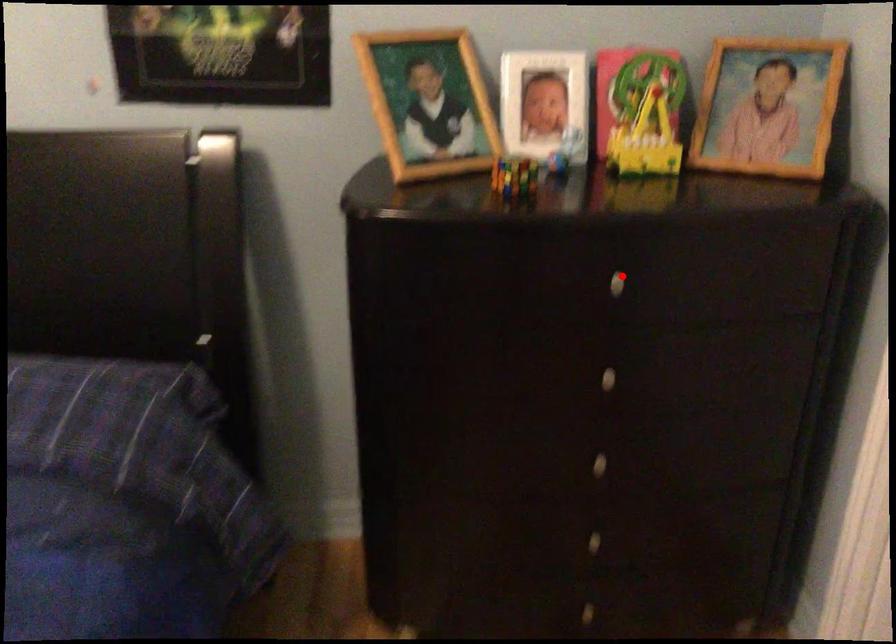
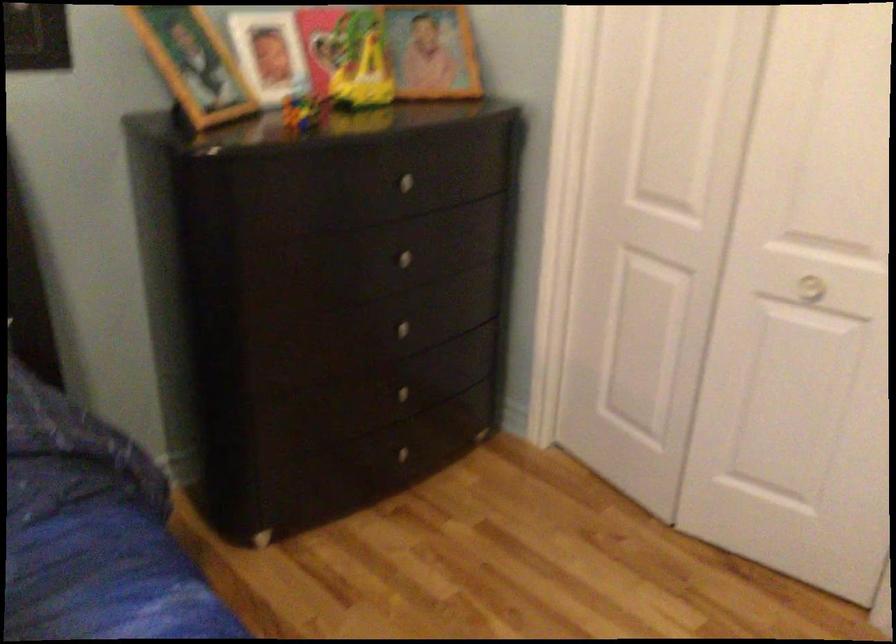
Question: I am providing you with two images of the same scene from different viewpoints. Image1 has a red point marked. In image2, the corresponding 3D location appears at what relative position? Reply with the corresponding letter.

Choices:
 (A) Closer
 (B) Farther

Answer: (B)